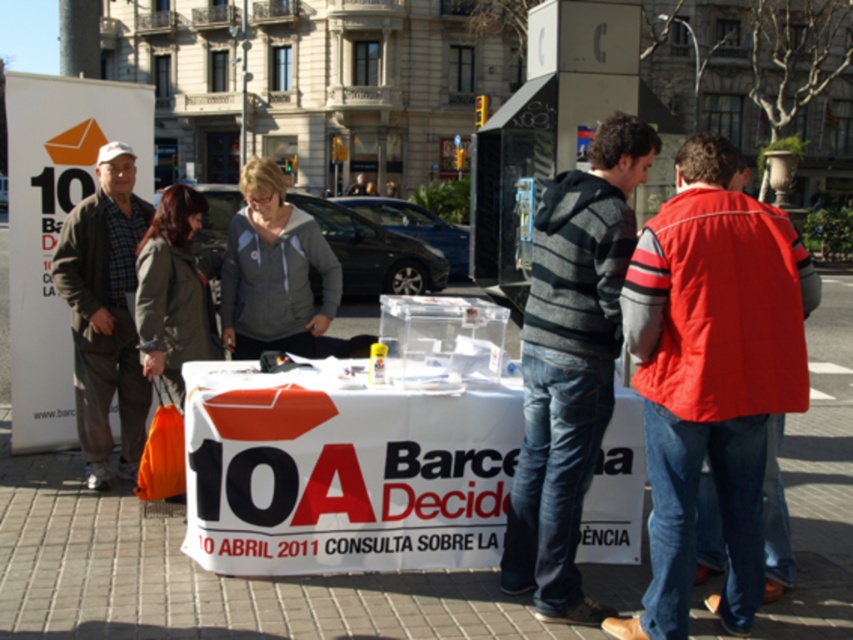
Consider the image. Who is more forward, [740,195] or [125,269]?

Positioned in front is point [740,195].

In the scene shown: Which is more to the right, red nylon jacket at center or plaid fabric shirt at left?

red nylon jacket at center

Which is behind, point (718, 225) or point (122, 196)?

The point (122, 196) is more distant.

Identify the location of red nylon jacket at center. (711, 376).

Does white paper table at center appear on the left side of red nylon jacket at center?

Correct, you'll find white paper table at center to the left of red nylon jacket at center.

Who is taller, white paper table at center or red nylon jacket at center?

With more height is red nylon jacket at center.

You are a GUI agent. You are given a task and a screenshot of the screen. Output one action in this format:
    pyautogui.click(x=<x>, y=<y>)
    Task: Click on the white paper table at center
    This screenshot has height=640, width=853.
    Given the screenshot: What is the action you would take?
    pyautogui.click(x=343, y=472)

At what (x,y) coordinates should I click in order to perform the action: click on white paper table at center. Please return your answer as a coordinate pair (x, y). Looking at the image, I should click on (343, 472).

Is white paper table at center wider than gray fleece jacket at center?

Indeed, white paper table at center has a greater width compared to gray fleece jacket at center.

Does white paper table at center have a lesser width compared to gray fleece jacket at center?

No, white paper table at center is not thinner than gray fleece jacket at center.

Is point (589, 540) positioned after point (337, 296)?

No, it is not.

Locate an element on the screen. The image size is (853, 640). white paper table at center is located at coordinates (343, 472).